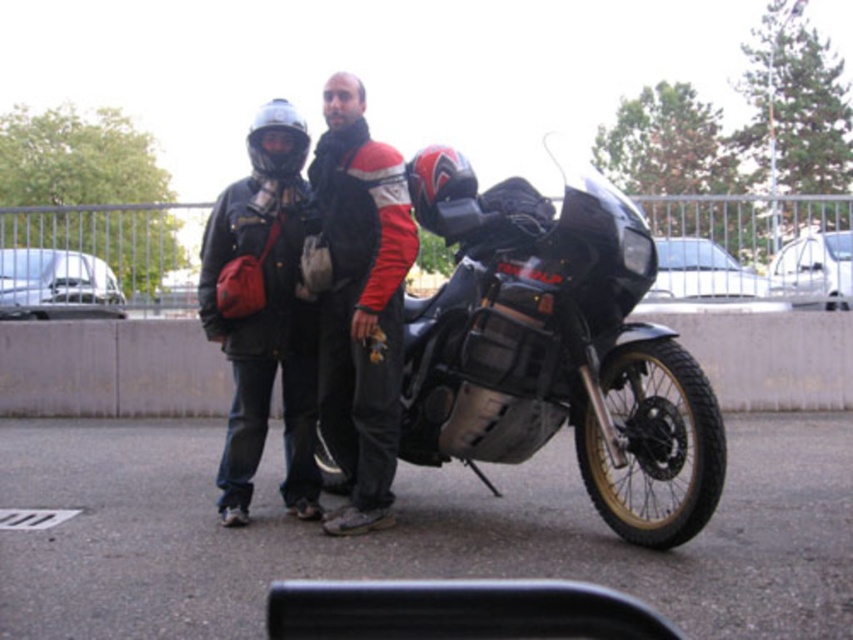
Question: Does black matte motorcycle at center appear over matte black jacket at center?

Choices:
 (A) no
 (B) yes

Answer: (A)

Question: Does black matte motorcycle at center have a larger size compared to matte black jacket at center?

Choices:
 (A) no
 (B) yes

Answer: (B)

Question: Can you confirm if black matte motorcycle at center is wider than matte black jacket at center?

Choices:
 (A) no
 (B) yes

Answer: (B)